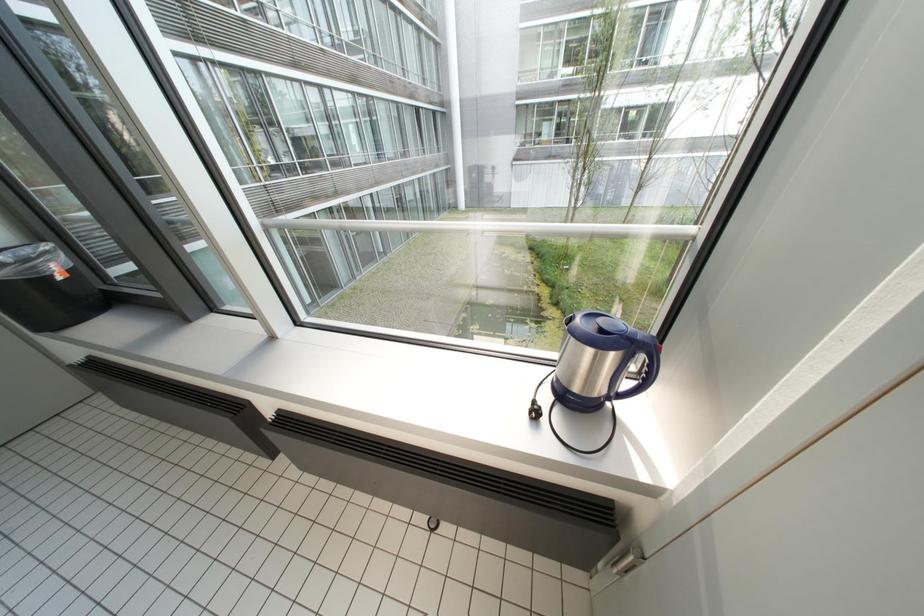
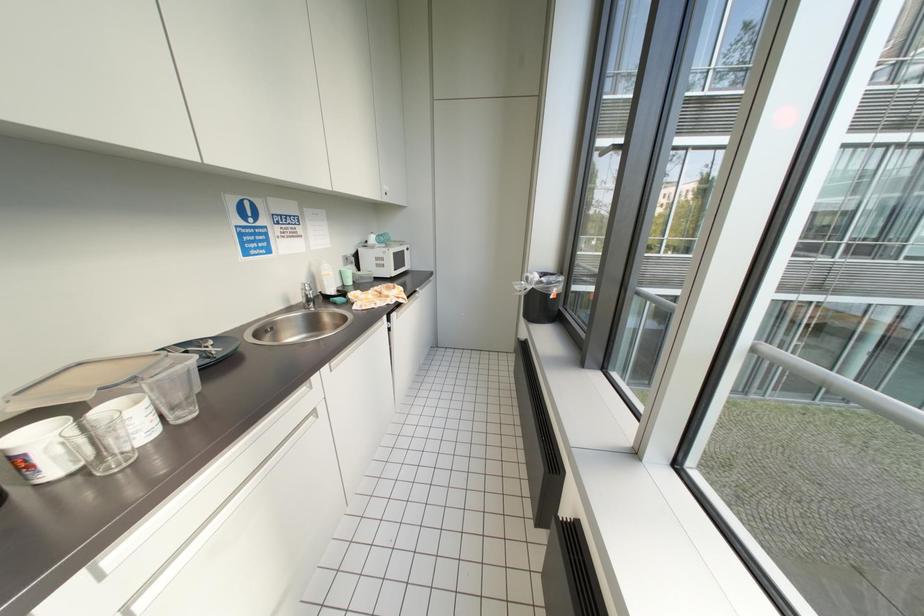
Question: The images are taken continuously from a first-person perspective. In which direction is your viewpoint rotating?

Choices:
 (A) Left
 (B) Right
 (C) Up
 (D) Down

Answer: (A)